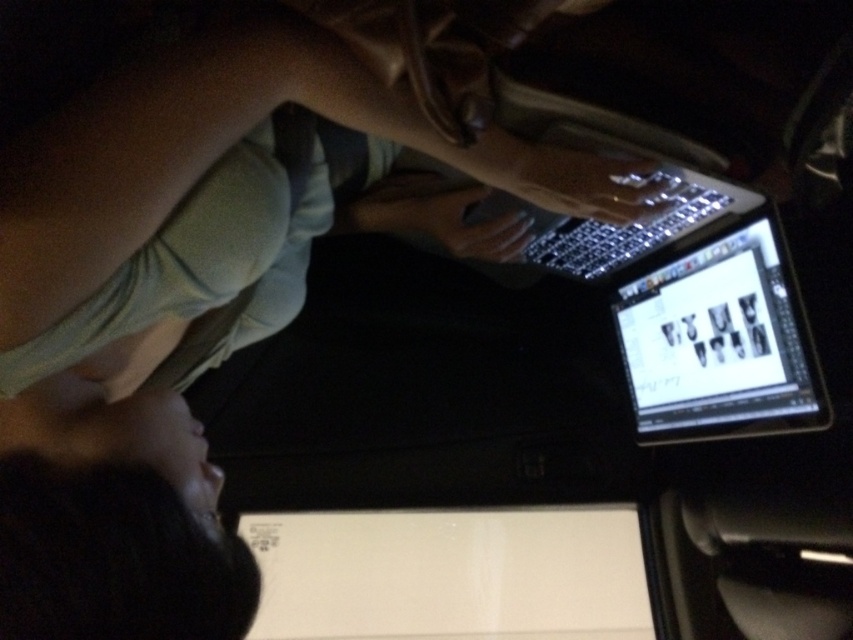
You are a graphic designer working on a project. You have both a shiny black tablet at center and a sleek silver laptop at center in front of you. Which device is positioned to the right of the other?

The shiny black tablet at center is positioned to the right of the sleek silver laptop at center.

You are sitting in a vehicle and want to reach two points on the laptop screen to adjust your design. The points are labeled as point 1 at coordinates point [142,541] and point 2 at coordinates point [703,292]. Which point is closer to you when looking at the screen?

Point [142,541] is in front of point [703,292], so it is closer to you when looking at the screen.

You are a photographer trying to capture a clear image of the shiny black tablet at center. The camera you are using has a minimum focus distance of 36 inches. Can you focus on the tablet without moving closer?

The shiny black tablet at center is 38.32 inches away from the camera, which is beyond the minimum focus distance of 36 inches. Therefore, the camera can focus on the shiny black tablet at center without needing to move closer.